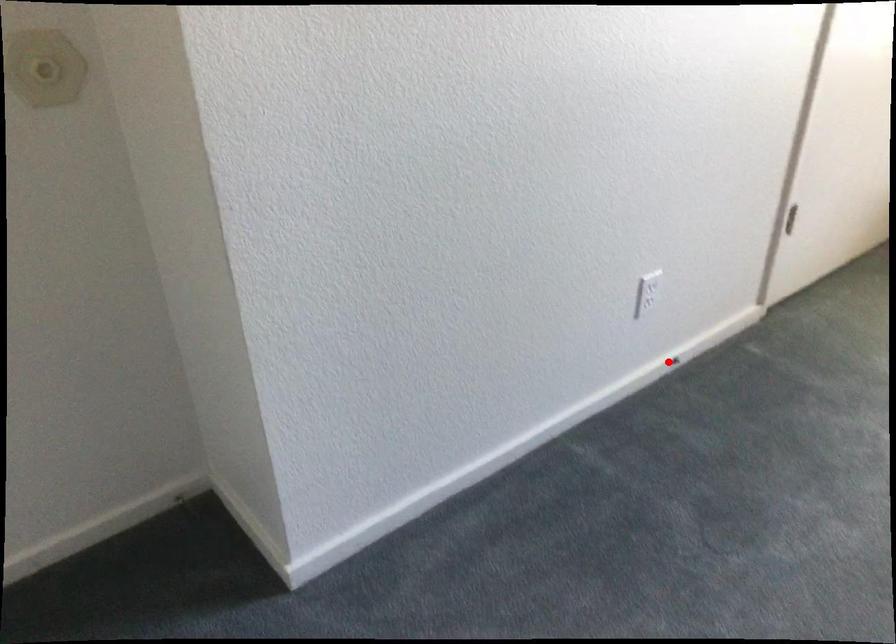
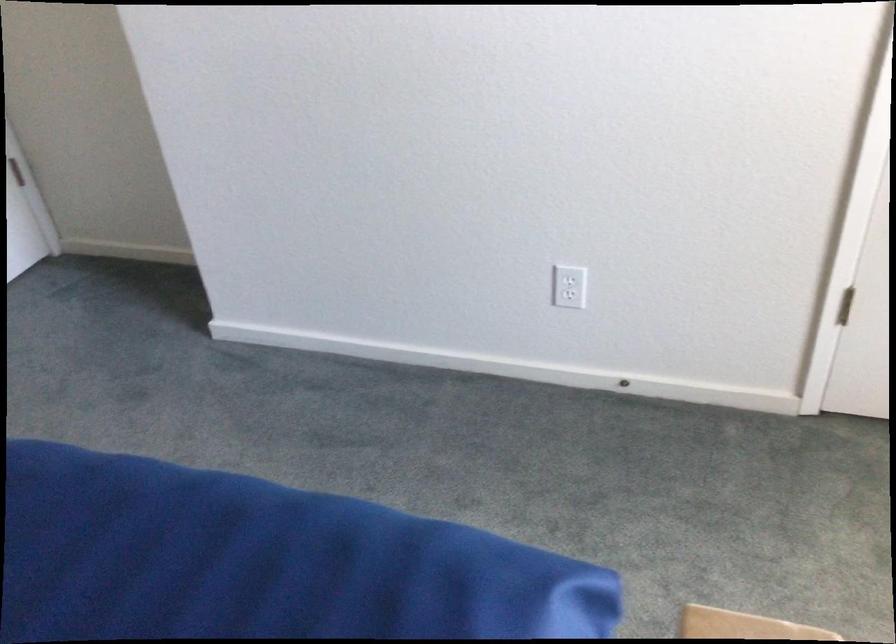
Locate, in the second image, the point that corresponds to the highlighted location in the first image.

(624, 384)